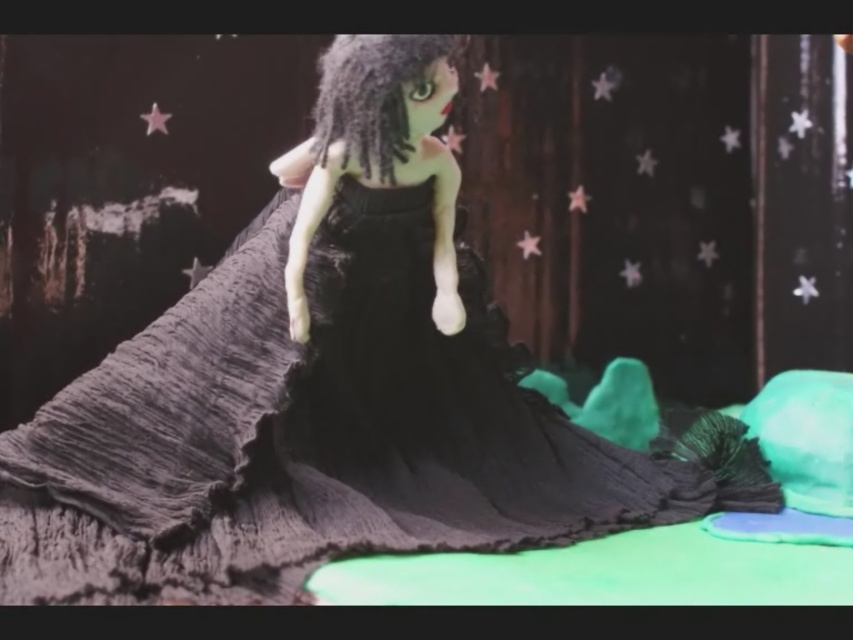
Question: Which point appears closest to the camera in this image?

Choices:
 (A) (735, 428)
 (B) (351, 125)
 (C) (343, 134)

Answer: (B)

Question: Does matte black dress at center come behind satin black hair at center?

Choices:
 (A) yes
 (B) no

Answer: (B)

Question: Does matte black dress at center have a greater width compared to satin black hair at center?

Choices:
 (A) no
 (B) yes

Answer: (B)

Question: Which object is closer to the camera taking this photo?

Choices:
 (A) black crinkled fabric dress at center
 (B) matte black dress at center

Answer: (A)

Question: Estimate the real-world distances between objects in this image. Which object is closer to the black crinkled fabric dress at center?

Choices:
 (A) satin black hair at center
 (B) matte black dress at center

Answer: (B)

Question: Is black crinkled fabric dress at center above matte black dress at center?

Choices:
 (A) no
 (B) yes

Answer: (B)